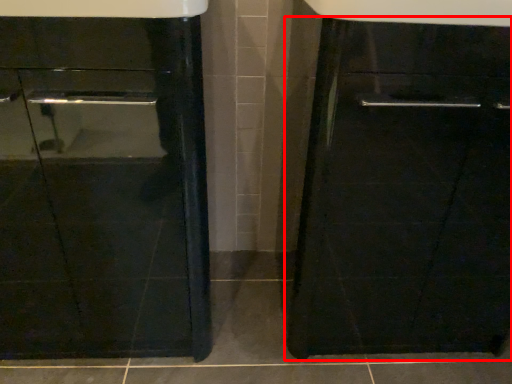
Question: From the image's perspective, what is the correct spatial positioning of cabinetry (annotated by the red box) in reference to sink?

Choices:
 (A) below
 (B) above

Answer: (B)